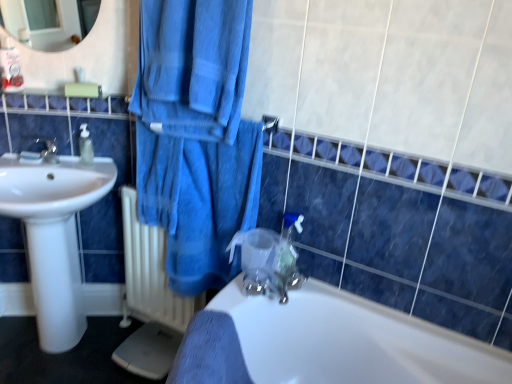
Question: From a real-world perspective, is blue cotton towel at center located beneath white metallic radiator at lower left?

Choices:
 (A) yes
 (B) no

Answer: (B)

Question: Can you confirm if blue cotton towel at center is taller than white metallic radiator at lower left?

Choices:
 (A) no
 (B) yes

Answer: (A)

Question: Considering the relative positions of blue cotton towel at center and white metallic radiator at lower left in the image provided, is blue cotton towel at center in front of white metallic radiator at lower left?

Choices:
 (A) yes
 (B) no

Answer: (A)

Question: Is blue cotton towel at center bigger than white metallic radiator at lower left?

Choices:
 (A) yes
 (B) no

Answer: (A)

Question: Is blue cotton towel at center completely or partially outside of white metallic radiator at lower left?

Choices:
 (A) yes
 (B) no

Answer: (A)

Question: Could white metallic radiator at lower left be considered to be inside blue cotton towel at center?

Choices:
 (A) yes
 (B) no

Answer: (B)

Question: Is white glossy sink at left positioned far away from white glossy bathtub at lower center?

Choices:
 (A) no
 (B) yes

Answer: (A)

Question: Can you confirm if white glossy sink at left is positioned to the left of white glossy bathtub at lower center?

Choices:
 (A) yes
 (B) no

Answer: (A)

Question: From a real-world perspective, is white glossy sink at left under white glossy bathtub at lower center?

Choices:
 (A) no
 (B) yes

Answer: (A)

Question: Is white glossy sink at left wider than white glossy bathtub at lower center?

Choices:
 (A) yes
 (B) no

Answer: (B)

Question: Is white glossy sink at left smaller than white glossy bathtub at lower center?

Choices:
 (A) yes
 (B) no

Answer: (A)

Question: Would you say white glossy sink at left is outside white glossy bathtub at lower center?

Choices:
 (A) no
 (B) yes

Answer: (B)

Question: Is the position of transparent plastic faucet at center more distant than that of white glossy sink at left?

Choices:
 (A) no
 (B) yes

Answer: (B)